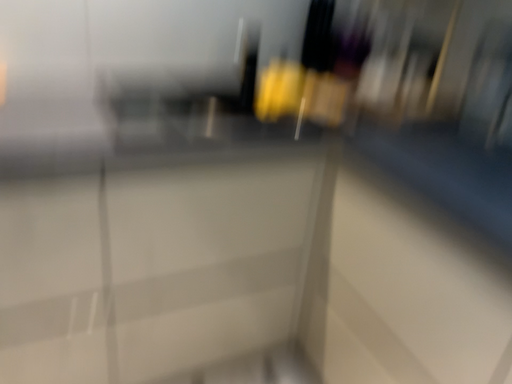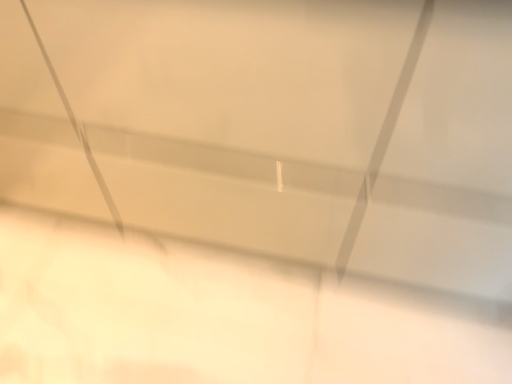
Question: How did the camera likely rotate when shooting the video?

Choices:
 (A) rotated downward
 (B) rotated upward

Answer: (A)